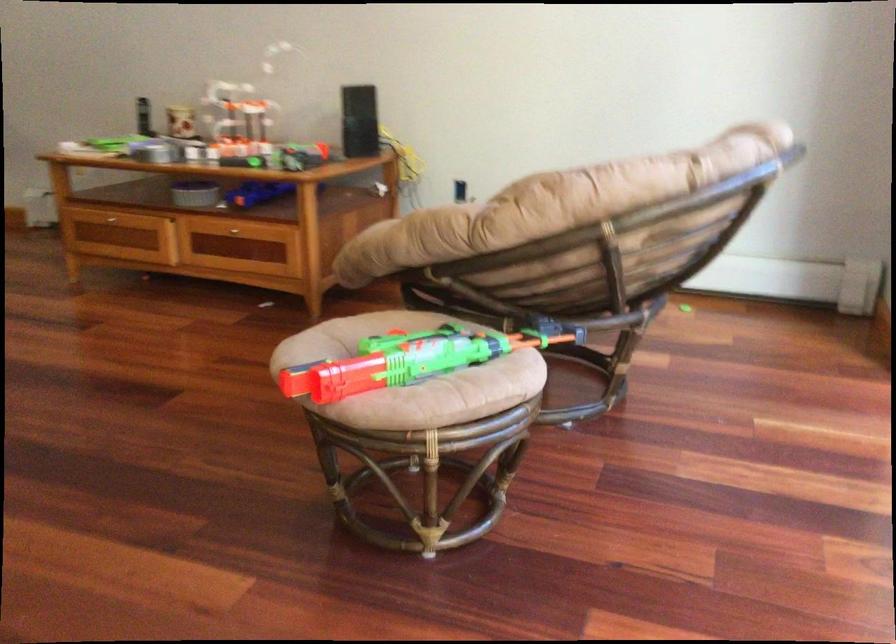
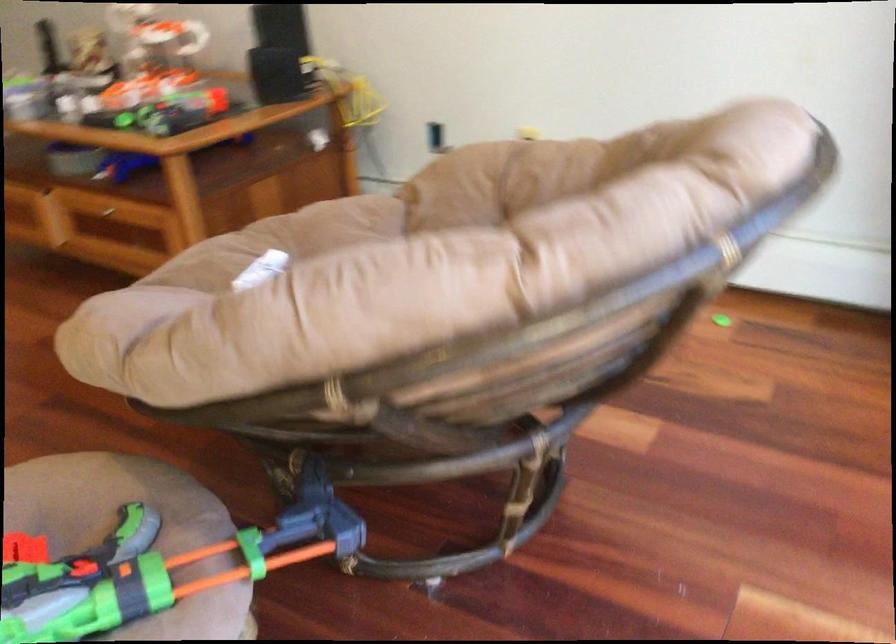
In the second image, find the point that corresponds to pixel 238 232 in the first image.

(107, 213)